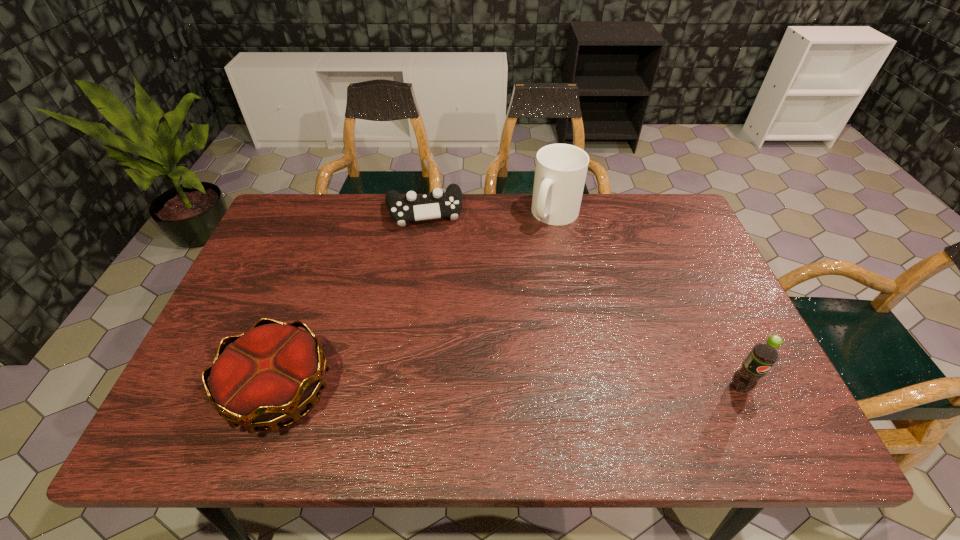
The height and width of the screenshot is (540, 960). Find the location of `vacant space on the desktop that is between the leftmost object and the rightmost object and is positioned on the surface of the third object from right to left`. vacant space on the desktop that is between the leftmost object and the rightmost object and is positioned on the surface of the third object from right to left is located at coordinates (455, 389).

Locate an element on the screen. The height and width of the screenshot is (540, 960). vacant space on the desktop that is between the second shortest object and the rightmost object and is positioned on the handle side of the mug is located at coordinates (470, 389).